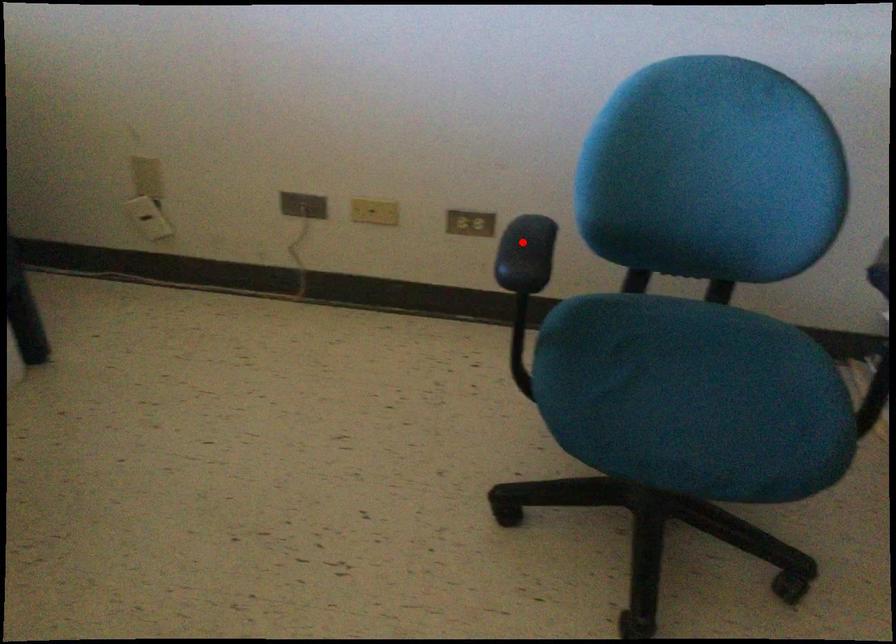
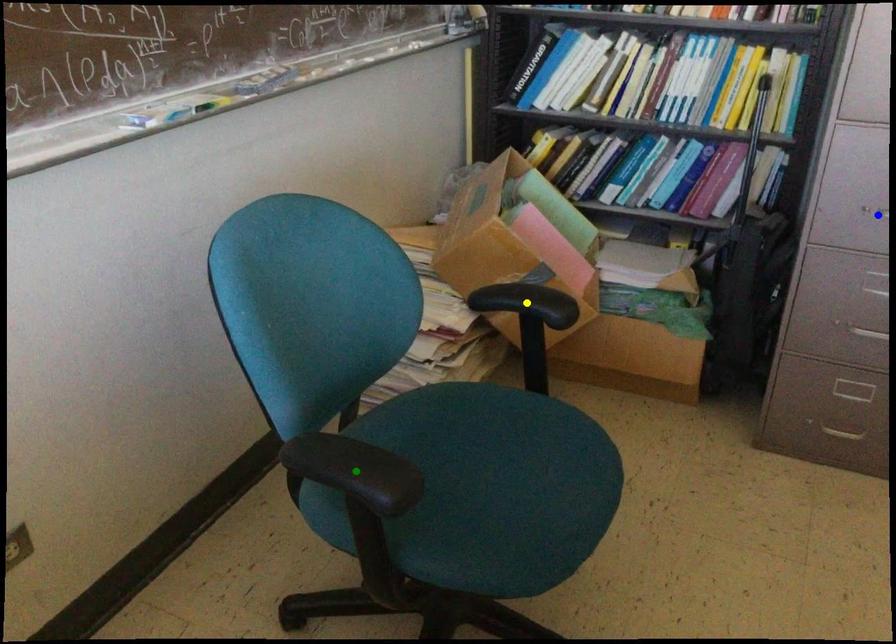
Question: I am providing you with two images of the same scene from different viewpoints. A red point is marked on the first image. You are given multiple points on the second image. Which mark in image 2 goes with the point in image 1?

Choices:
 (A) green point
 (B) yellow point
 (C) blue point

Answer: (A)